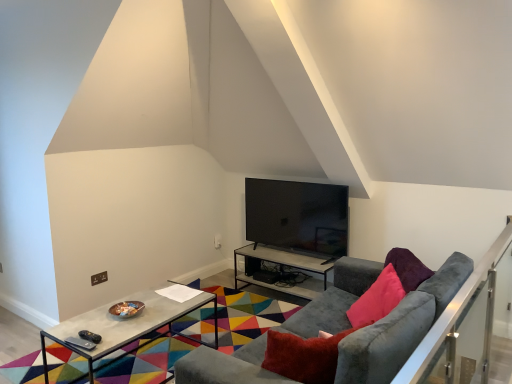
Question: Does black glossy tv at center come behind concrete table at center, acting as the first table starting from the front?

Choices:
 (A) yes
 (B) no

Answer: (A)

Question: Is black glossy tv at center taller than concrete table at center, acting as the first table starting from the front?

Choices:
 (A) yes
 (B) no

Answer: (A)

Question: Does black glossy tv at center appear on the left side of concrete table at center, acting as the first table starting from the front?

Choices:
 (A) yes
 (B) no

Answer: (B)

Question: Is black glossy tv at center wider than concrete table at center, the first table positioned from the left?

Choices:
 (A) no
 (B) yes

Answer: (A)

Question: Is black glossy tv at center facing away from concrete table at center, the first table positioned from the left?

Choices:
 (A) yes
 (B) no

Answer: (B)

Question: Is velvet grey couch at center in front of or behind metallic gray table at center, placed as the 2th table when sorted from left to right, in the image?

Choices:
 (A) front
 (B) behind

Answer: (A)

Question: From their relative heights in the image, would you say velvet grey couch at center is taller or shorter than metallic gray table at center, the 1th table positioned from the right?

Choices:
 (A) short
 (B) tall

Answer: (B)

Question: In terms of size, does velvet grey couch at center appear bigger or smaller than metallic gray table at center, the 1th table positioned from the right?

Choices:
 (A) small
 (B) big

Answer: (B)

Question: Is velvet grey couch at center inside the boundaries of metallic gray table at center, the 1th table positioned from the right, or outside?

Choices:
 (A) inside
 (B) outside

Answer: (B)

Question: From the image's perspective, relative to satin silver balustrade at right, is black glossy tv at center above or below?

Choices:
 (A) above
 (B) below

Answer: (A)

Question: In terms of size, does black glossy tv at center appear bigger or smaller than satin silver balustrade at right?

Choices:
 (A) small
 (B) big

Answer: (A)

Question: Relative to satin silver balustrade at right, is black glossy tv at center in front or behind?

Choices:
 (A) behind
 (B) front

Answer: (A)

Question: From a real-world perspective, relative to satin silver balustrade at right, is black glossy tv at center vertically above or below?

Choices:
 (A) below
 (B) above

Answer: (B)

Question: Relative to metallic gray table at center, the 1th table viewed from the back, is black glossy tv at center in front or behind?

Choices:
 (A) behind
 (B) front

Answer: (B)

Question: Would you say black glossy tv at center is to the left or to the right of metallic gray table at center, arranged as the second table when viewed from the front, in the picture?

Choices:
 (A) left
 (B) right

Answer: (B)